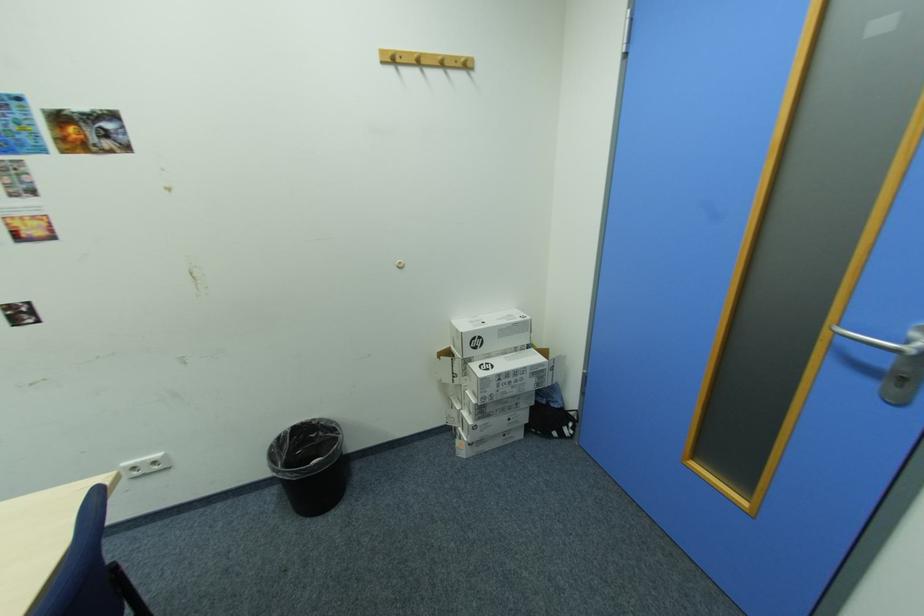
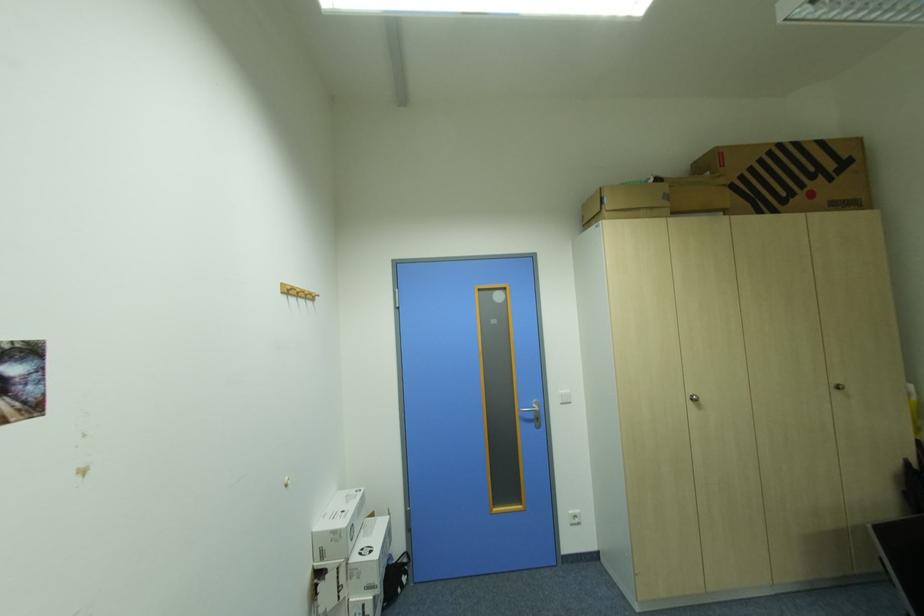
Where in the second image is the point corresponding to [482,394] from the first image?

(377, 590)